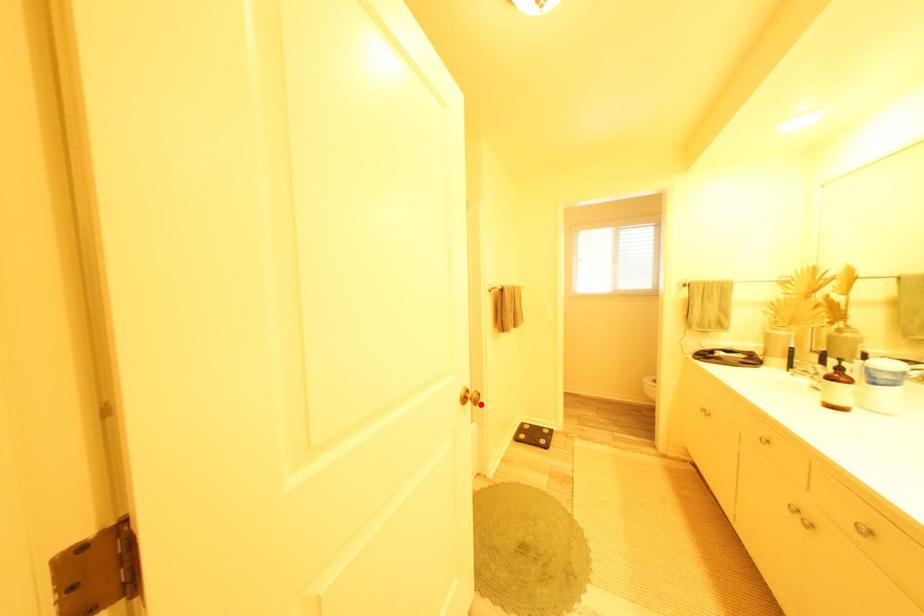
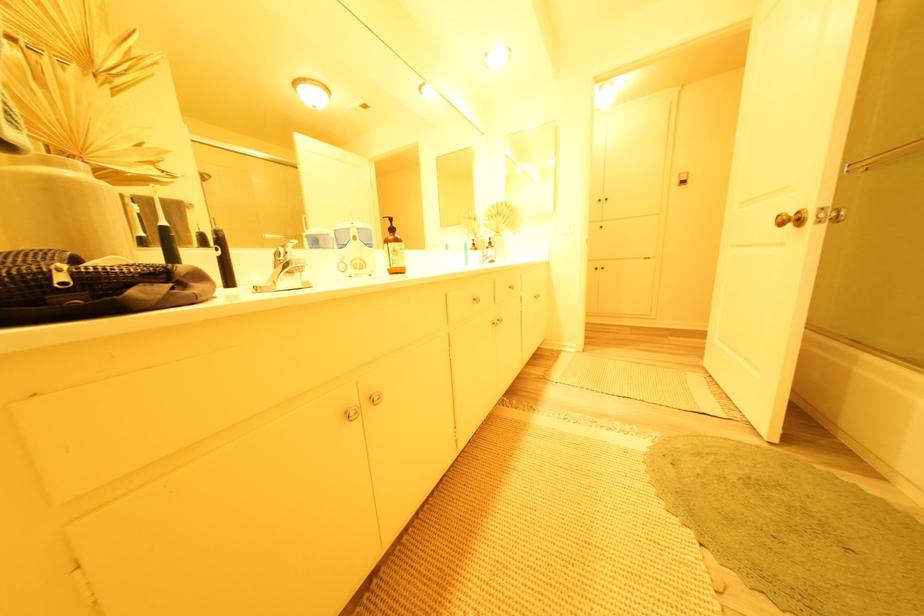
In the second image, find the point that corresponds to the highlighted location in the first image.

(801, 227)